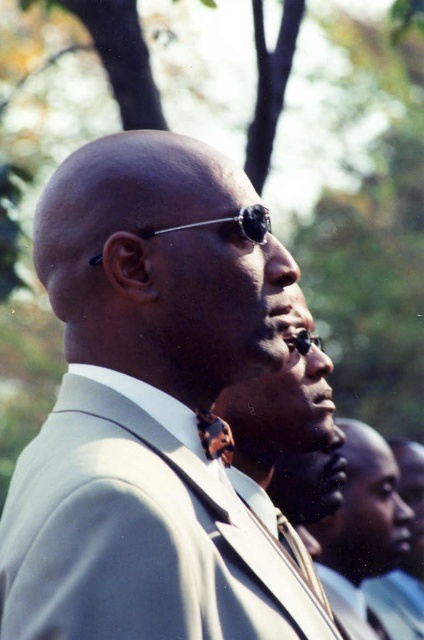
You are a fashion designer observing the scene. You need to determine which item has a greater width between the matte black suit at center and the dark brown leather tie at center. Which one is wider?

The matte black suit at center is wider than the dark brown leather tie at center according to the description.

You are a photographer setting up for an outdoor event. You have two subjects wearing the gray matte suit at center and the matte black suit at center. The minimum distance required between subjects for clear focus is 2.5 meters. Can both subjects be in focus simultaneously with your current setup?

The gray matte suit at center is 2.49 meters from the matte black suit at center. Since the required distance is 2.5 meters, the subjects are slightly too close to be in focus simultaneously with the current setup.